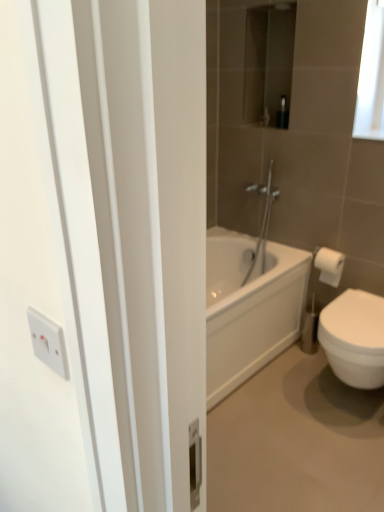
At what (x,y) coordinates should I click in order to perform the action: click on white glossy toilet at lower right. Please return your answer as a coordinate pair (x, y). Looking at the image, I should click on (296, 441).

The height and width of the screenshot is (512, 384). What do you see at coordinates (296, 441) in the screenshot?
I see `white glossy toilet at lower right` at bounding box center [296, 441].

The image size is (384, 512). Find the location of `white glossy toilet at lower right`. white glossy toilet at lower right is located at coordinates (296, 441).